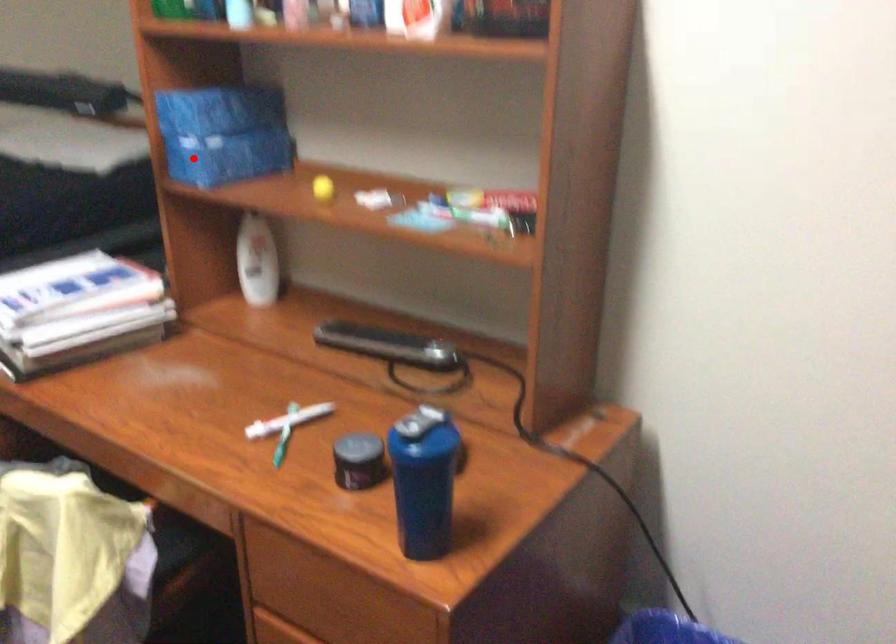
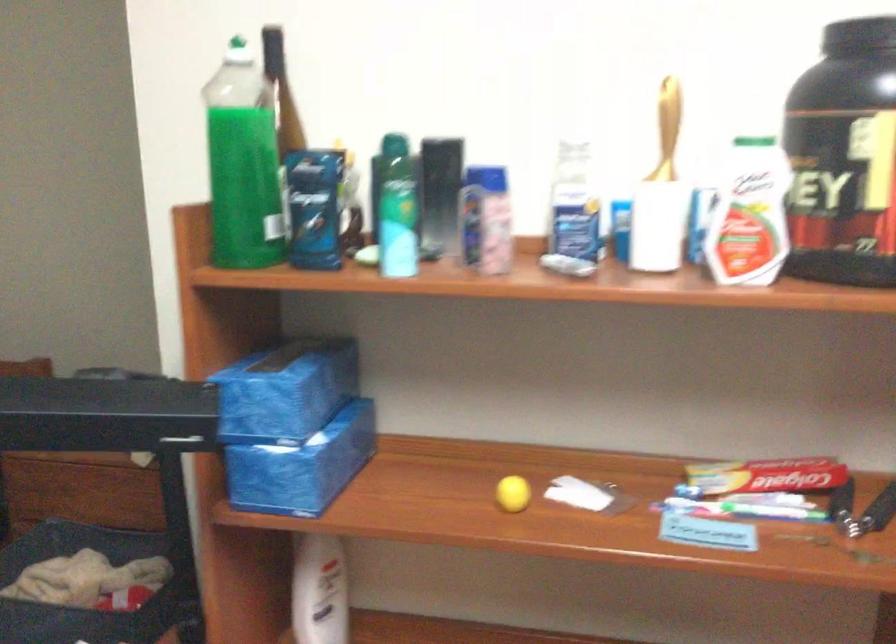
In the second image, find the point that corresponds to the highlighted location in the first image.

(288, 478)